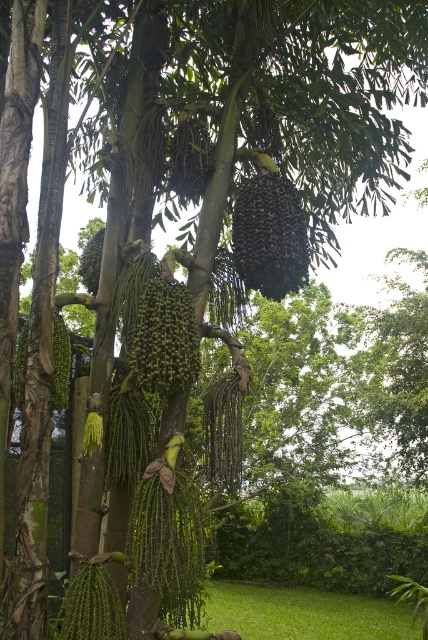
Is green grass at lower center thinner than green matte palm fruit at left?

Incorrect, green grass at lower center's width is not less than green matte palm fruit at left's.

In the scene shown: Does green grass at lower center lie behind green matte palm fruit at left?

Yes, it is.

Is point (362, 621) farther from camera compared to point (61, 356)?

Yes.

Identify the location of green grass at lower center. (305, 612).

Is dark green glossy palm fruit at center above green matte palm fruit at center-left?

No.

Is point (272, 246) positioned after point (98, 275)?

That is False.

Is point (285, 180) farther from camera compared to point (97, 248)?

No, (285, 180) is closer to viewer.

Locate an element on the screen. The height and width of the screenshot is (640, 428). dark green glossy palm fruit at center is located at coordinates (270, 236).

Is point (177, 332) positioned behind point (64, 358)?

No, (177, 332) is closer to viewer.

Between green matte palm fruit at center and green matte palm fruit at left, which one appears on the right side from the viewer's perspective?

green matte palm fruit at center is more to the right.

Locate an element on the screen. The image size is (428, 640). green matte palm fruit at center is located at coordinates (165, 339).

Image resolution: width=428 pixels, height=640 pixels. Identify the location of green matte palm fruit at center. click(x=165, y=339).